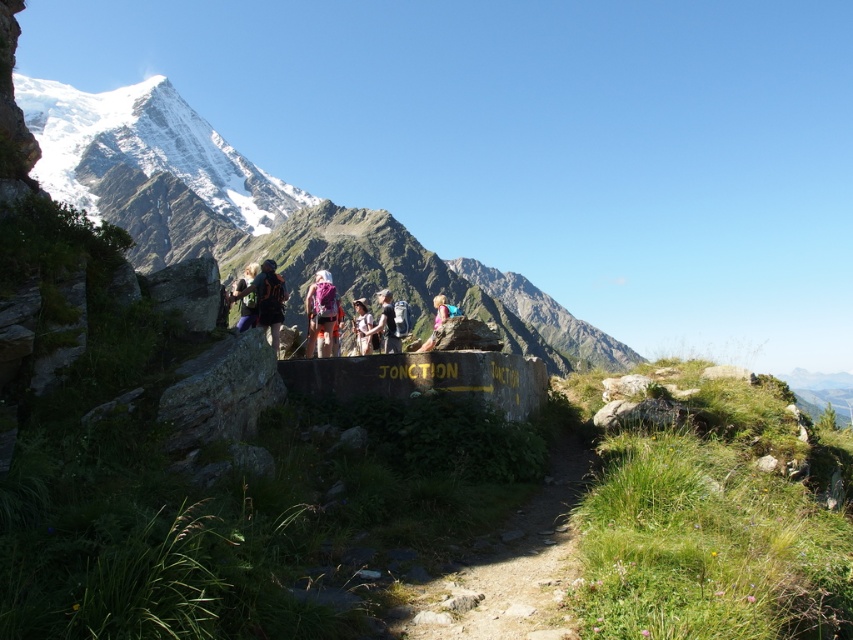
Question: Which point appears closest to the camera in this image?

Choices:
 (A) (309, 323)
 (B) (386, 330)
 (C) (73, 100)

Answer: (A)

Question: Among these points, which one is nearest to the camera?

Choices:
 (A) (492, 550)
 (B) (144, 253)
 (C) (318, 282)
 (D) (390, 291)

Answer: (A)

Question: Does snowy granite mountain at upper left have a larger size compared to black fabric backpack at center?

Choices:
 (A) no
 (B) yes

Answer: (B)

Question: Can you confirm if matte black backpack at center is thinner than camouflage fabric backpack at center?

Choices:
 (A) no
 (B) yes

Answer: (A)

Question: Which point is farther from the camera taking this photo?

Choices:
 (A) (318, 326)
 (B) (392, 339)

Answer: (B)

Question: Can you confirm if dirt path at center is positioned to the right of matte black backpack at center?

Choices:
 (A) no
 (B) yes

Answer: (B)